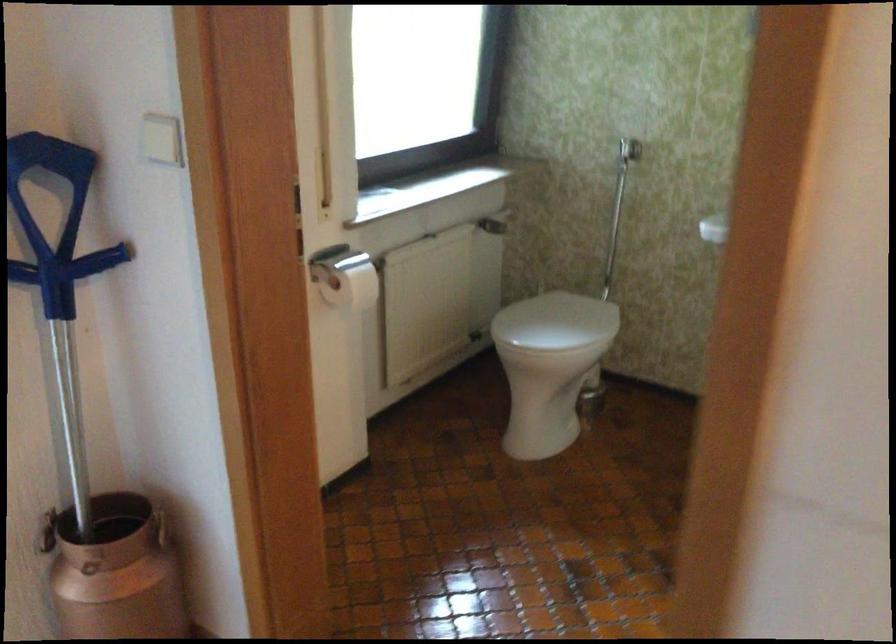
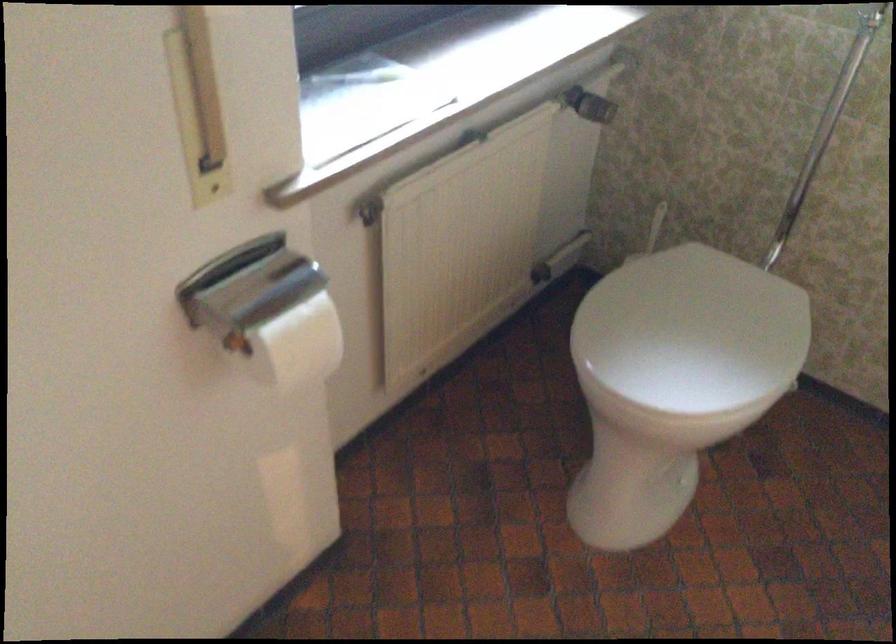
Locate, in the second image, the point that corresponds to the point at 308,180 in the first image.

(197, 106)